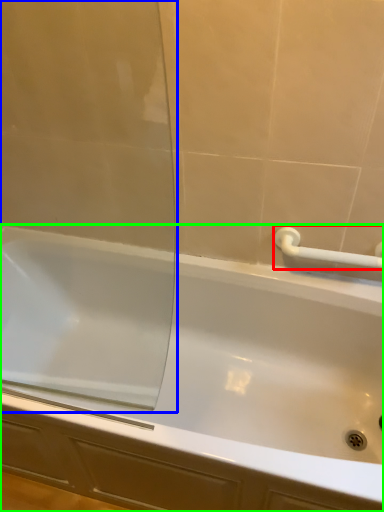
Question: Considering the real-world distances, which object is closest to towel bar (highlighted by a red box)? screen door (highlighted by a blue box) or bathtub (highlighted by a green box).

Choices:
 (A) screen door
 (B) bathtub

Answer: (B)